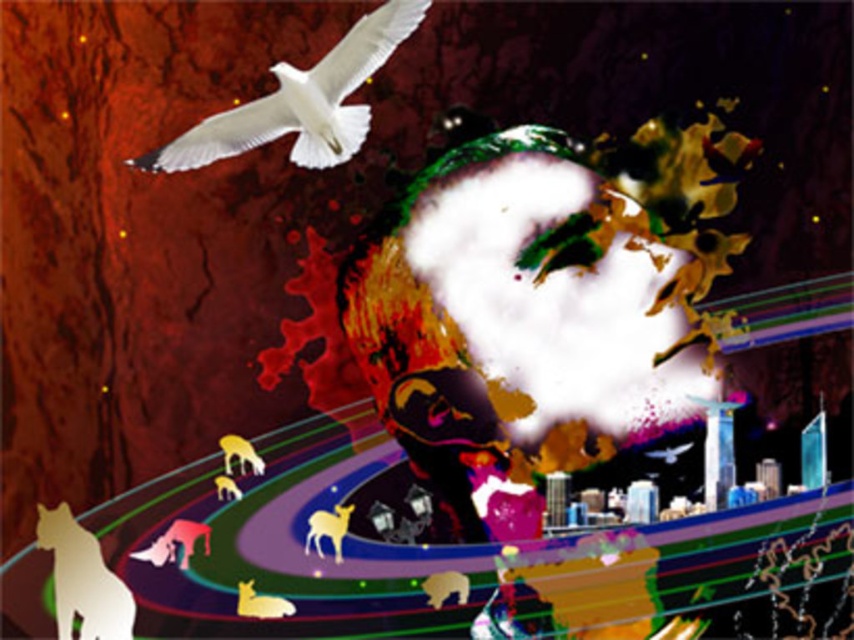
Which object is located at the coordinates point (x=261, y=604)?

The silvery metallic deer at lower left is located at point (x=261, y=604).

You are an observer looking at the scene. There are two deer in the lower left corner, a silvery metallic deer at lower left and a shiny gold deer at lower left. Which deer is positioned to the right of the other?

The silvery metallic deer at lower left is to the right of the shiny gold deer at lower left.